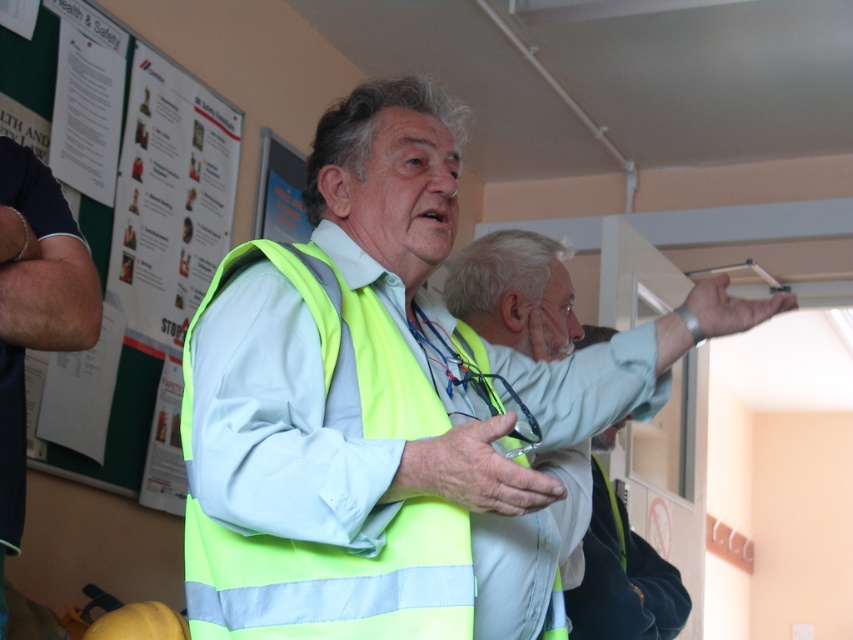
You are a safety inspector checking the layout of the workshop. You notice two reflective vests in the scene. According to the safety protocol, the green reflective vest at left must be positioned to the left of the yellow reflective vest at center. Does the current arrangement comply with this requirement?

Yes, the current arrangement complies with the safety protocol because the green reflective vest at left is positioned to the left of the yellow reflective vest at center as required.